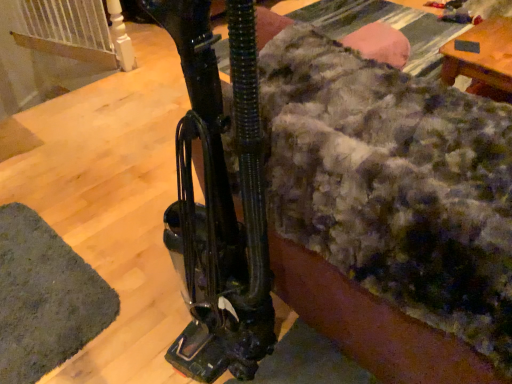
Question: Is point (396, 178) closer or farther from the camera than point (18, 370)?

Choices:
 (A) farther
 (B) closer

Answer: (B)

Question: In terms of height, does fuzzy woolen blanket at center look taller or shorter compared to green fuzzy mat at lower left?

Choices:
 (A) short
 (B) tall

Answer: (B)

Question: Visually, is fuzzy woolen blanket at center positioned to the left or to the right of green fuzzy mat at lower left?

Choices:
 (A) right
 (B) left

Answer: (A)

Question: In the image, is green fuzzy mat at lower left on the left side or the right side of fuzzy woolen blanket at center?

Choices:
 (A) left
 (B) right

Answer: (A)

Question: From the image's perspective, is green fuzzy mat at lower left above or below fuzzy woolen blanket at center?

Choices:
 (A) below
 (B) above

Answer: (A)

Question: Considering the positions of green fuzzy mat at lower left and fuzzy woolen blanket at center in the image, is green fuzzy mat at lower left taller or shorter than fuzzy woolen blanket at center?

Choices:
 (A) tall
 (B) short

Answer: (B)

Question: Is green fuzzy mat at lower left in front of or behind fuzzy woolen blanket at center in the image?

Choices:
 (A) front
 (B) behind

Answer: (B)